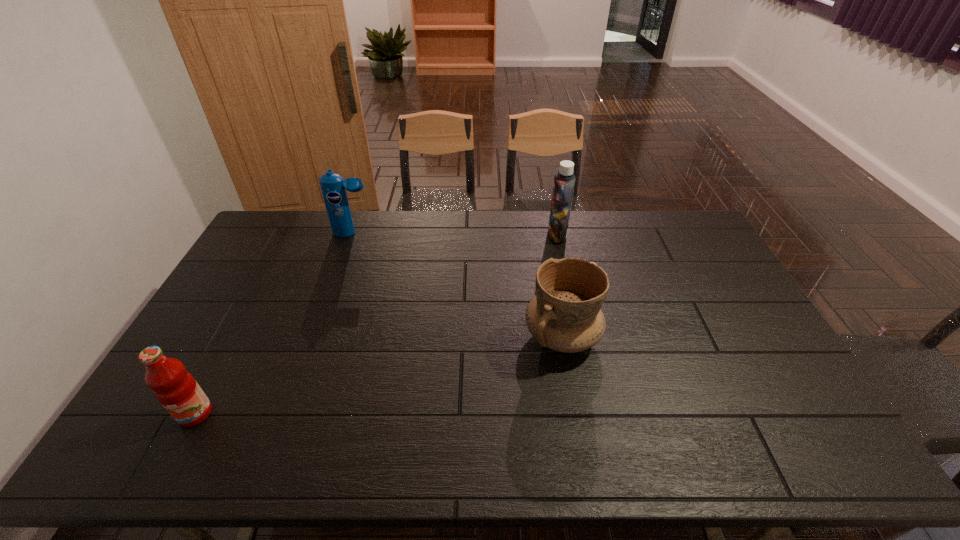
You are a GUI agent. You are given a task and a screenshot of the screen. Output one action in this format:
    pyautogui.click(x=<x>, y=<y>)
    Task: Click on the vacant region that satisfies the following two spatial constraints: 1. on the front side of the left shampoo; 2. on the left side of the second nearest object
    
    Given the screenshot: What is the action you would take?
    pyautogui.click(x=316, y=336)

You are a GUI agent. You are given a task and a screenshot of the screen. Output one action in this format:
    pyautogui.click(x=<x>, y=<y>)
    Task: Click on the vacant space that satisfies the following two spatial constraints: 1. on the front label of the right shampoo; 2. on the front side of the pottery
    
    Given the screenshot: What is the action you would take?
    pyautogui.click(x=579, y=336)